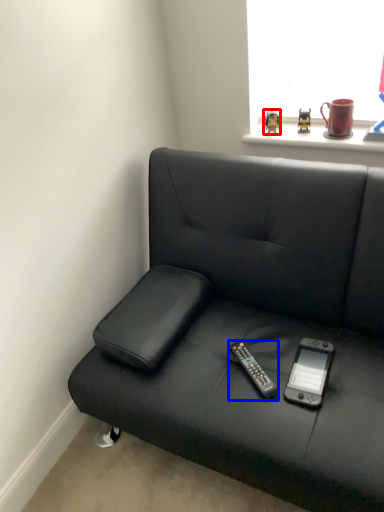
Question: Which point is further to the camera, toy (highlighted by a red box) or remote (highlighted by a blue box)?

Choices:
 (A) toy
 (B) remote

Answer: (A)